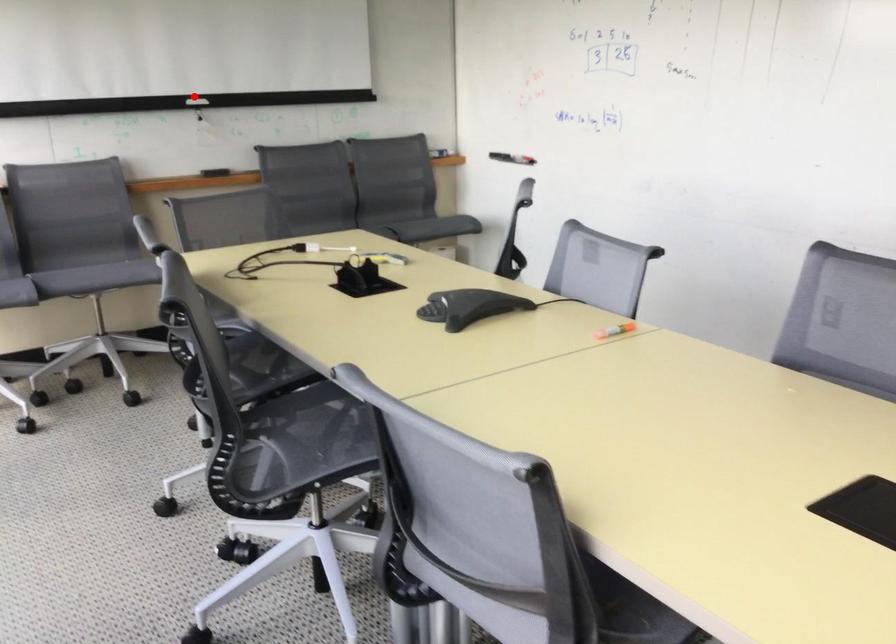
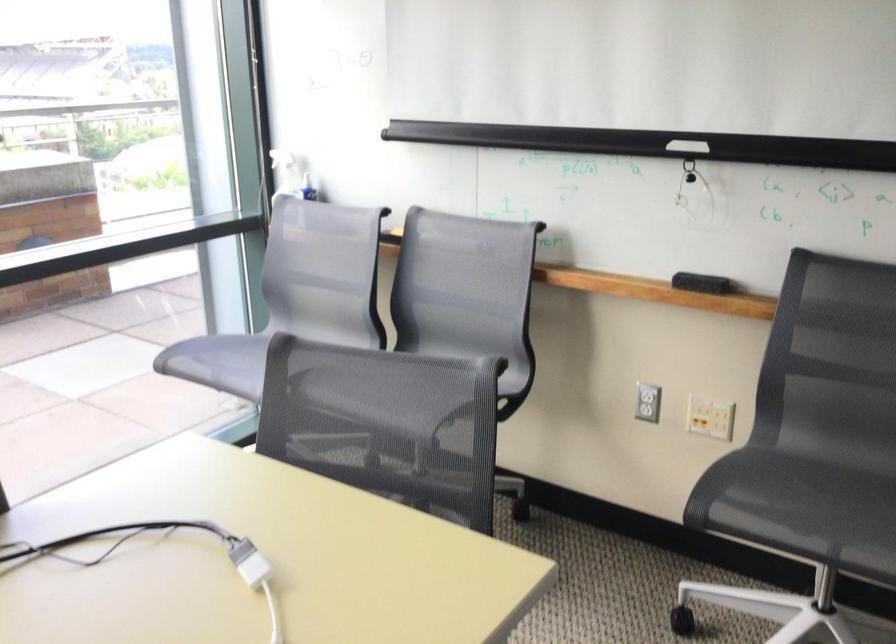
Question: I am providing you with two images of the same scene from different viewpoints. Image1 has a red point marked. In image2, the corresponding 3D location appears at what relative position? Reply with the corresponding letter.

Choices:
 (A) Closer
 (B) Farther

Answer: (A)